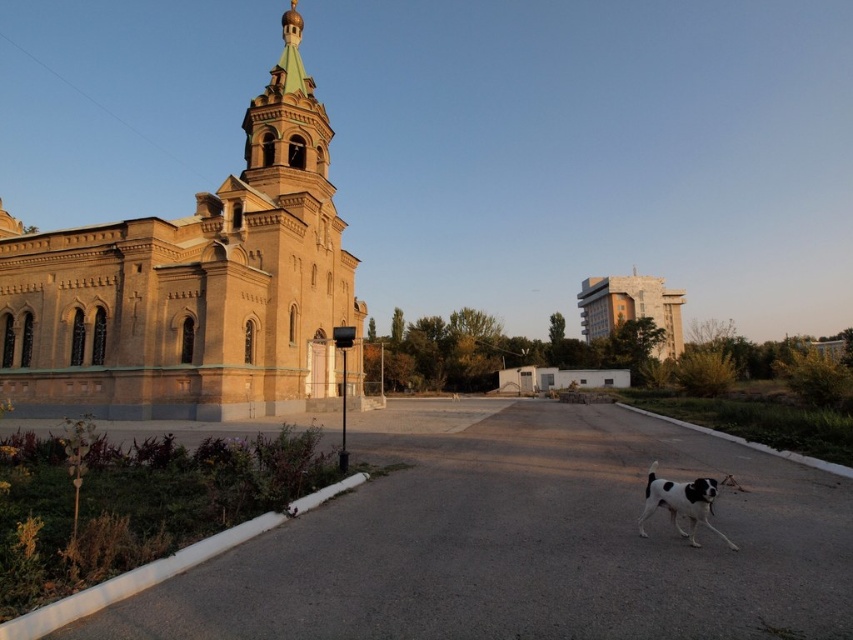
Between point (322, 140) and point (694, 509), which one is positioned behind?

Positioned behind is point (322, 140).

Does green copper spire at upper center appear on the right side of black and white fur dog at lower right?

In fact, green copper spire at upper center is to the left of black and white fur dog at lower right.

Who is more distant from viewer, (318, 196) or (650, 513)?

Point (318, 196)

The height and width of the screenshot is (640, 853). Identify the location of green copper spire at upper center. (287, 124).

Between green copper spire at upper center and matte beige building at upper right, which one appears on the right side from the viewer's perspective?

Positioned to the right is matte beige building at upper right.

Can you confirm if green copper spire at upper center is thinner than matte beige building at upper right?

Correct, green copper spire at upper center's width is less than matte beige building at upper right's.

I want to click on green copper spire at upper center, so click(287, 124).

Is brown brick church at left positioned at the back of matte beige building at upper right?

That is False.

From the picture: Is brown brick church at left wider than matte beige building at upper right?

In fact, brown brick church at left might be narrower than matte beige building at upper right.

What do you see at coordinates (194, 288) in the screenshot?
I see `brown brick church at left` at bounding box center [194, 288].

Find the location of `brown brick church at left`. brown brick church at left is located at coordinates (194, 288).